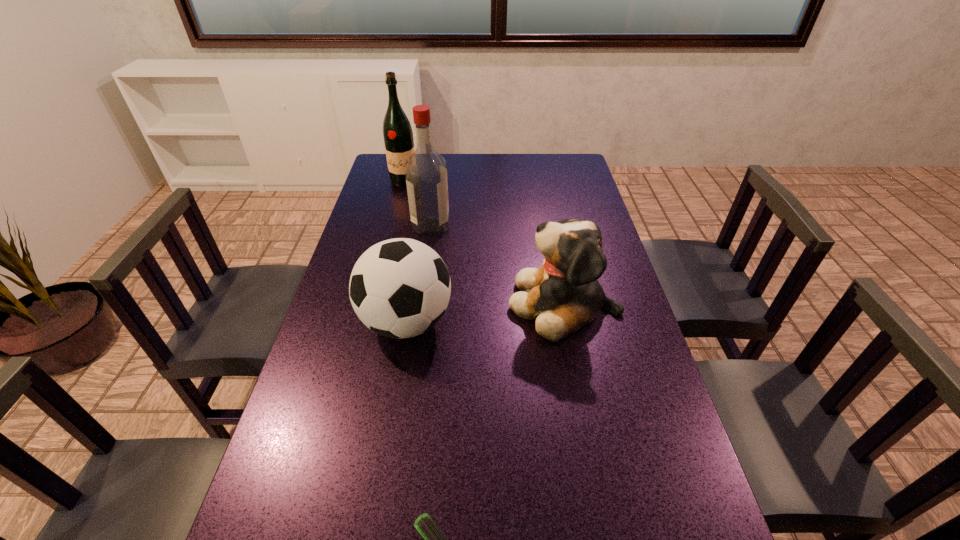
Identify the location of blank space located 0.120m at the face of the puppy. The height and width of the screenshot is (540, 960). (467, 303).

Locate an element on the screen. vacant space located on the front of the soccer ball is located at coordinates (378, 490).

Locate an element on the screen. The height and width of the screenshot is (540, 960). object at the far edge is located at coordinates (397, 132).

In order to click on liquor located in the left edge section of the desktop in this screenshot , I will do `click(397, 132)`.

The height and width of the screenshot is (540, 960). I want to click on soccer ball at the left edge, so click(399, 288).

I want to click on object at the right edge, so click(563, 295).

The image size is (960, 540). Find the location of `object located at the far left corner`. object located at the far left corner is located at coordinates (397, 132).

The width and height of the screenshot is (960, 540). In order to click on vacant space at the far edge in this screenshot , I will do `click(462, 181)`.

The width and height of the screenshot is (960, 540). I want to click on vacant space at the left edge, so click(x=389, y=194).

This screenshot has height=540, width=960. In the image, there is a desktop. Identify the location of free space at the right edge. (638, 492).